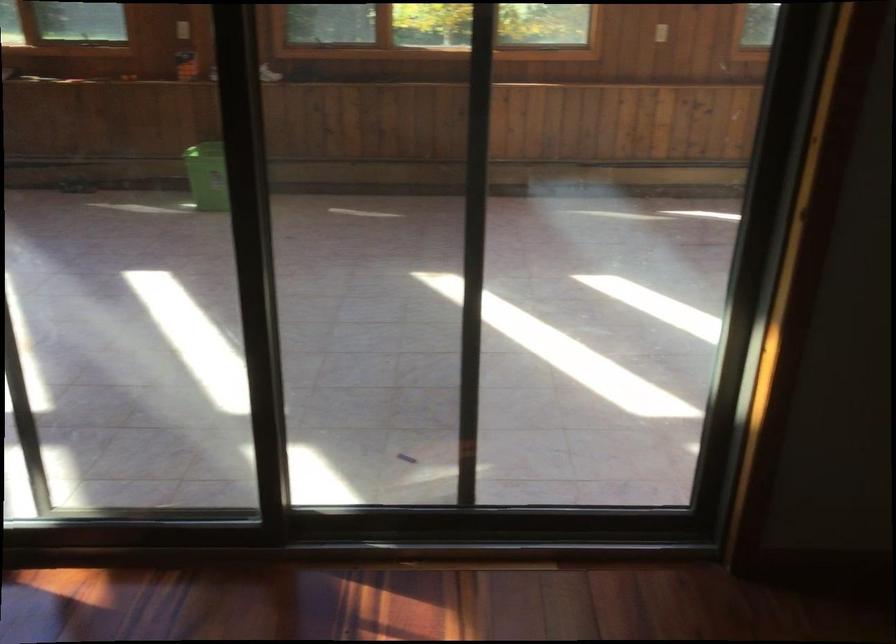
Where would you lift the green plastic bin? Please return your answer as a coordinate pair (x, y).

(207, 176)